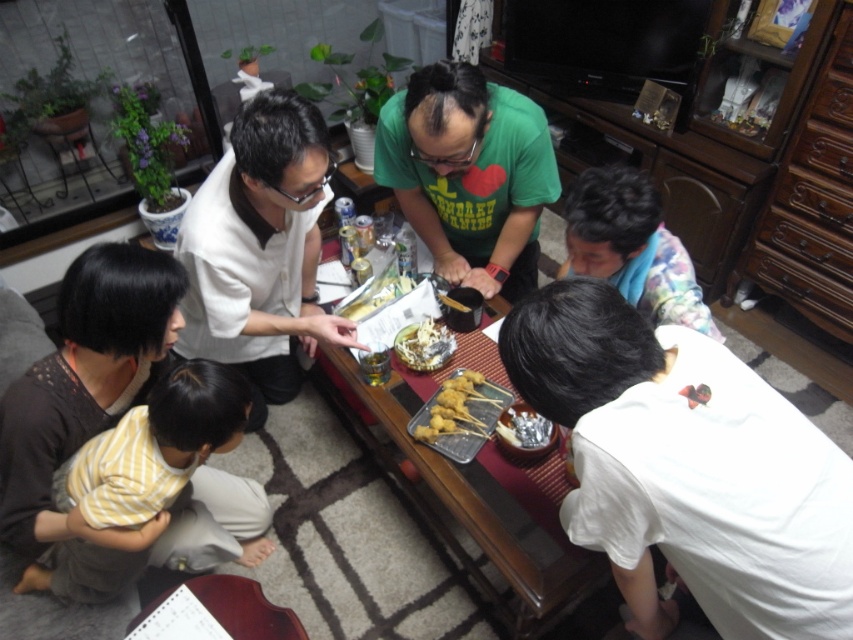
Who is shorter, green matte shirt at center or matte plastic bowl at center?

matte plastic bowl at center

Does point (485, 161) come farther from viewer compared to point (381, 300)?

No, (485, 161) is in front of (381, 300).

Locate an element on the screen. Image resolution: width=853 pixels, height=640 pixels. green matte shirt at center is located at coordinates (468, 173).

Is wooden tray at center wider than green matte shirt at center?

Yes.

Can you confirm if wooden tray at center is smaller than green matte shirt at center?

Incorrect, wooden tray at center is not smaller in size than green matte shirt at center.

Who is more distant from viewer, (488, 563) or (427, 246)?

Positioned behind is point (427, 246).

Locate an element on the screen. The width and height of the screenshot is (853, 640). wooden tray at center is located at coordinates (474, 492).

Between shiny metallic bowl at center and matte plastic bowl at center, which one has less height?

With less height is shiny metallic bowl at center.

Between shiny metallic bowl at center and matte plastic bowl at center, which one appears on the right side from the viewer's perspective?

shiny metallic bowl at center is more to the right.

Is point (428, 353) in front of point (407, 280)?

Yes, point (428, 353) is in front of point (407, 280).

Identify the location of shiny metallic bowl at center. (424, 346).